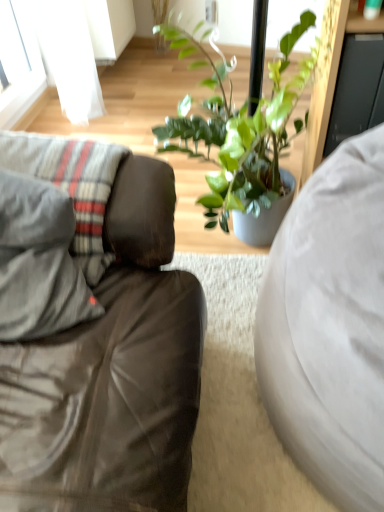
This screenshot has width=384, height=512. What do you see at coordinates (330, 326) in the screenshot? I see `white fabric studio couch at right, which is the first studio couch in right-to-left order` at bounding box center [330, 326].

Locate an element on the screen. The height and width of the screenshot is (512, 384). gray fabric pillow at left is located at coordinates (71, 184).

From a real-world perspective, is matte gray couch at left, which appears as the 2th studio couch when viewed from the right, on top of white fabric studio couch at right, which is counted as the second studio couch, starting from the left?

Correct, in the physical world, matte gray couch at left, which appears as the 2th studio couch when viewed from the right, is higher than white fabric studio couch at right, which is counted as the second studio couch, starting from the left.

Is matte gray couch at left, the first studio couch positioned from the left, far from white fabric studio couch at right, which is counted as the second studio couch, starting from the left?

They are positioned close to each other.

Does point (24, 324) lie behind point (326, 246)?

Yes.

Consider the image. From a real-world perspective, which object stands above the other?

gray fabric pillow at left.

Is gray fabric pillow at left with matte gray couch at left, which appears as the 2th studio couch when viewed from the right?

No.

Considering the sizes of objects gray fabric pillow at left and matte gray couch at left, which appears as the 2th studio couch when viewed from the right, in the image provided, who is bigger, gray fabric pillow at left or matte gray couch at left, which appears as the 2th studio couch when viewed from the right,?

matte gray couch at left, which appears as the 2th studio couch when viewed from the right, is bigger.

Looking at this image, is gray fabric pillow at left not inside matte gray couch at left, the first studio couch positioned from the left?

That's incorrect, gray fabric pillow at left is not completely outside matte gray couch at left, the first studio couch positioned from the left.

Is matte gray couch at left, which appears as the 2th studio couch when viewed from the right, further to the viewer compared to gray fabric pillow at left?

That is False.

Based on their sizes in the image, would you say matte gray couch at left, which appears as the 2th studio couch when viewed from the right, is bigger or smaller than gray fabric pillow at left?

Clearly, matte gray couch at left, which appears as the 2th studio couch when viewed from the right, is larger in size than gray fabric pillow at left.

Identify the location of studio couch that is the 1st one when counting downward from the gray fabric pillow at left (from the image's perspective). click(x=93, y=334).

Measure the distance from matte gray couch at left, the first studio couch positioned from the left, to gray fabric pillow at left.

The distance of matte gray couch at left, the first studio couch positioned from the left, from gray fabric pillow at left is 10.79 centimeters.

From the image's perspective, which is below, white fabric studio couch at right, which is the first studio couch in right-to-left order, or gray fabric pillow at left?

white fabric studio couch at right, which is the first studio couch in right-to-left order, is shown below in the image.

Is the surface of white fabric studio couch at right, which is the first studio couch in right-to-left order, in direct contact with gray fabric pillow at left?

No, white fabric studio couch at right, which is the first studio couch in right-to-left order, is not making contact with gray fabric pillow at left.

Considering the sizes of objects white fabric studio couch at right, which is the first studio couch in right-to-left order, and gray fabric pillow at left in the image provided, who is taller, white fabric studio couch at right, which is the first studio couch in right-to-left order, or gray fabric pillow at left?

With more height is white fabric studio couch at right, which is the first studio couch in right-to-left order.

Find the location of `pillow that is above the white fabric studio couch at right, which is counted as the second studio couch, starting from the left (from a real-world perspective)`. pillow that is above the white fabric studio couch at right, which is counted as the second studio couch, starting from the left (from a real-world perspective) is located at coordinates (71, 184).

Does gray fabric pillow at left have a lesser height compared to white fabric studio couch at right, which is counted as the second studio couch, starting from the left?

Yes.

Could you tell me if gray fabric pillow at left is turned towards white fabric studio couch at right, which is counted as the second studio couch, starting from the left?

No, gray fabric pillow at left is not aimed at white fabric studio couch at right, which is counted as the second studio couch, starting from the left.

Can we say gray fabric pillow at left lies outside white fabric studio couch at right, which is the first studio couch in right-to-left order?

gray fabric pillow at left is positioned outside white fabric studio couch at right, which is the first studio couch in right-to-left order.

Is white fabric studio couch at right, which is counted as the second studio couch, starting from the left, taller or shorter than matte gray couch at left, which appears as the 2th studio couch when viewed from the right?

Considering their sizes, white fabric studio couch at right, which is counted as the second studio couch, starting from the left, has less height than matte gray couch at left, which appears as the 2th studio couch when viewed from the right.

Does point (283, 228) come closer to viewer compared to point (33, 431)?

No, (283, 228) is further to viewer.

Would you say white fabric studio couch at right, which is the first studio couch in right-to-left order, is outside matte gray couch at left, which appears as the 2th studio couch when viewed from the right?

Yes, white fabric studio couch at right, which is the first studio couch in right-to-left order, is located beyond the bounds of matte gray couch at left, which appears as the 2th studio couch when viewed from the right.

At what (x,y) coordinates should I click in order to perform the action: click on studio couch below the matte gray couch at left, which appears as the 2th studio couch when viewed from the right (from the image's perspective). Please return your answer as a coordinate pair (x, y). Looking at the image, I should click on pyautogui.click(x=330, y=326).

I want to click on pillow located above the matte gray couch at left, the first studio couch positioned from the left (from the image's perspective), so click(71, 184).

Looking at the image, which one is located closer to matte gray couch at left, the first studio couch positioned from the left, white fabric studio couch at right, which is counted as the second studio couch, starting from the left, or gray fabric pillow at left?

The object closer to matte gray couch at left, the first studio couch positioned from the left, is gray fabric pillow at left.

Looking at the image, which one is located further to white fabric studio couch at right, which is the first studio couch in right-to-left order, matte gray couch at left, the first studio couch positioned from the left, or gray fabric pillow at left?

Based on the image, gray fabric pillow at left appears to be further to white fabric studio couch at right, which is the first studio couch in right-to-left order.

Consider the image. Based on their spatial positions, is matte gray couch at left, which appears as the 2th studio couch when viewed from the right, or white fabric studio couch at right, which is the first studio couch in right-to-left order, further from gray fabric pillow at left?

white fabric studio couch at right, which is the first studio couch in right-to-left order.

Looking at the image, which one is located further to matte gray couch at left, which appears as the 2th studio couch when viewed from the right, gray fabric pillow at left or white fabric studio couch at right, which is counted as the second studio couch, starting from the left?

white fabric studio couch at right, which is counted as the second studio couch, starting from the left, is positioned further to the anchor matte gray couch at left, which appears as the 2th studio couch when viewed from the right.

When comparing their distances from white fabric studio couch at right, which is counted as the second studio couch, starting from the left, does gray fabric pillow at left or matte gray couch at left, the first studio couch positioned from the left, seem closer?

matte gray couch at left, the first studio couch positioned from the left.

Considering their positions, is white fabric studio couch at right, which is counted as the second studio couch, starting from the left, positioned further to gray fabric pillow at left than matte gray couch at left, which appears as the 2th studio couch when viewed from the right?

white fabric studio couch at right, which is counted as the second studio couch, starting from the left, lies further to gray fabric pillow at left than the other object.

The image size is (384, 512). Identify the location of studio couch between gray fabric pillow at left and white fabric studio couch at right, which is counted as the second studio couch, starting from the left, from left to right. (93, 334).